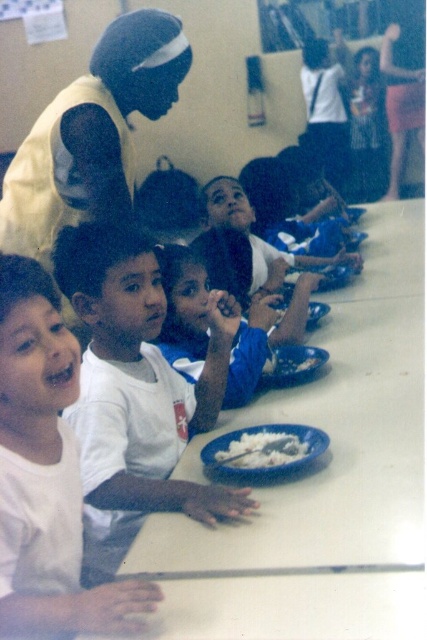
Question: Is white matte shirt at center wider than blue plastic plate at center?

Choices:
 (A) no
 (B) yes

Answer: (B)

Question: Can you confirm if white matte shirt at center is bigger than white creamy food at center?

Choices:
 (A) yes
 (B) no

Answer: (A)

Question: Which object is the farthest from the blue plastic plate at center?

Choices:
 (A) white matte shirt at left
 (B) white creamy food at center

Answer: (A)

Question: Which is farther from the blue jersey at center?

Choices:
 (A) white creamy food at center
 (B) white matte shirt at center

Answer: (A)

Question: From the image, what is the correct spatial relationship of white matte shirt at center in relation to white matte shirt at left?

Choices:
 (A) right
 (B) left

Answer: (A)

Question: Which of these objects is positioned closest to the blue plastic plate at center?

Choices:
 (A) white matte shirt at center
 (B) blue jersey at center

Answer: (B)